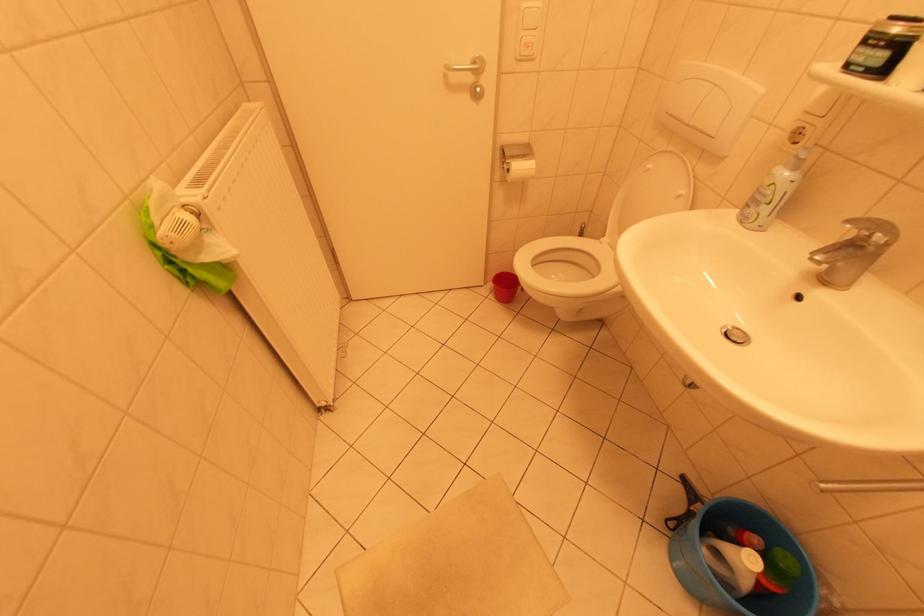
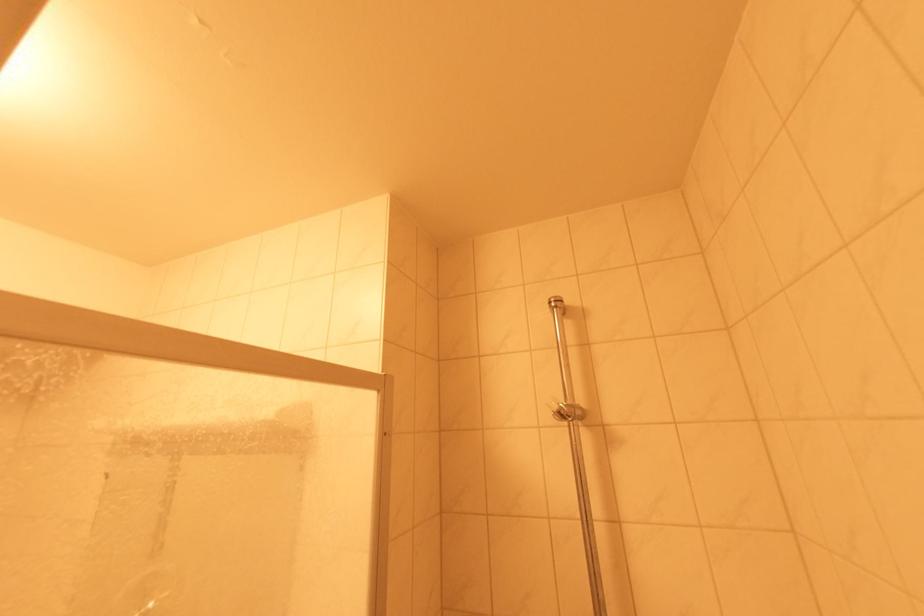
The images are taken continuously from a first-person perspective. In which direction is your viewpoint rotating?

The camera's rotation is toward right-up.